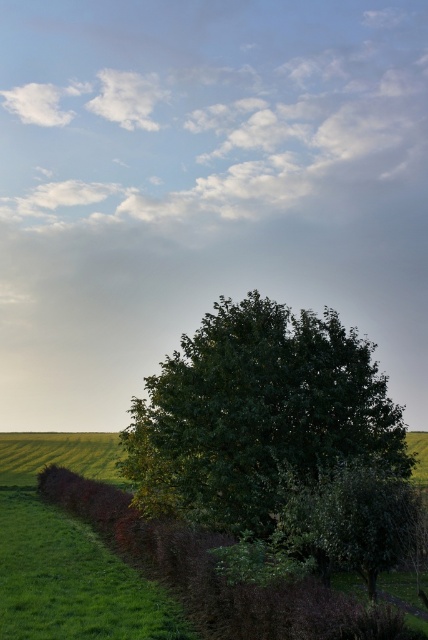
You are a gardener planning to plant a new flower bed between the green leafy tree at center and the brown textured hedge at lower left. Based on their positions, which direction should you place the flower bed to ensure it is between both?

The green leafy tree at center is positioned over the brown textured hedge at lower left, so placing the flower bed between them would require positioning it below the green leafy tree at center and above the brown textured hedge at lower left.

You are a landscape architect designing a garden and need to place a bench between the green leafy tree at center and the brown textured hedge at lower left. Given that the bench requires 3 meters of space to fit comfortably, can you determine if there is enough space between them based on their widths?

The green leafy tree at center is narrower than the brown textured hedge at lower left, but the exact distance between them isn